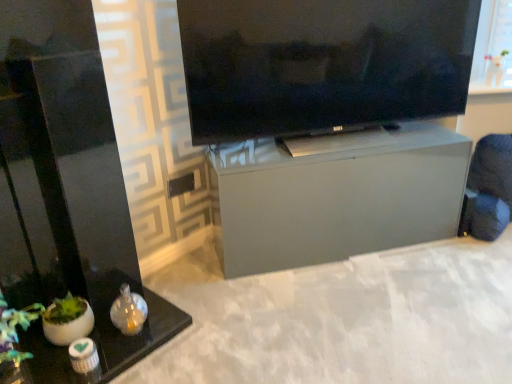
Image resolution: width=512 pixels, height=384 pixels. I want to click on vacant region below matte black tv at upper center (from a real-world perspective), so click(337, 142).